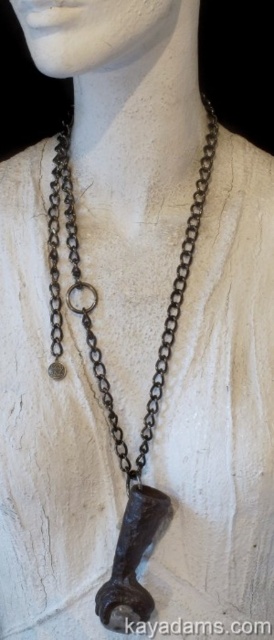
You are an artist planning to paint a portrait of the mannequin torso. You need to decide which object, the rusty chain at center or the white matte head at center, will require more attention to detail because of its size. Which one should you focus on?

The rusty chain at center is bigger than the white matte head at center, so you should focus more on the rusty chain at center due to its larger size requiring more detailed work.

You are an artist examining the mannequin and its necklace. You notice the white matte head at center and the matte black clasp at center. Which object is positioned closer to your viewpoint?

The white matte head at center is closer to the viewer than the matte black clasp at center.

Where is the rusty chain at center located in the image?

The rusty chain at center is located at point (96, 292) in the image.